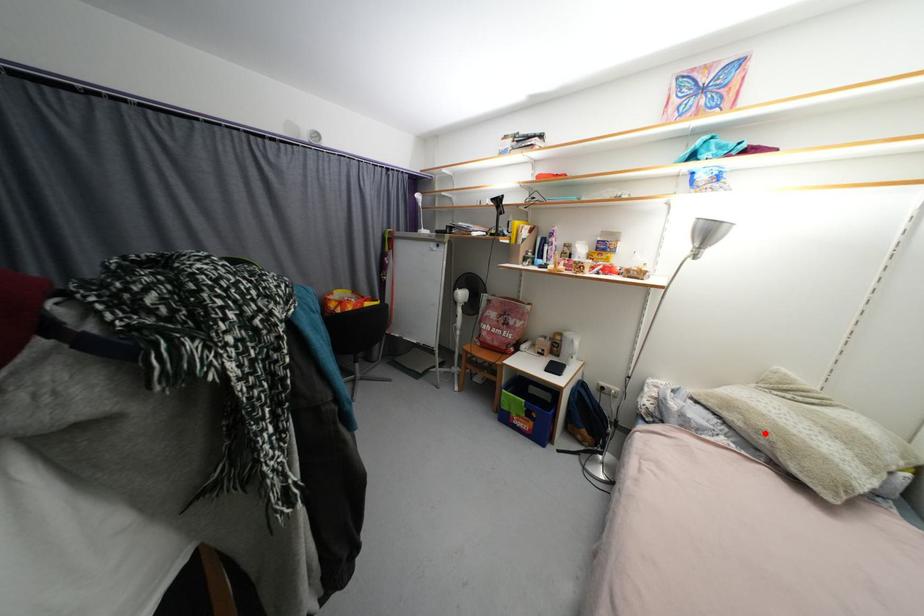
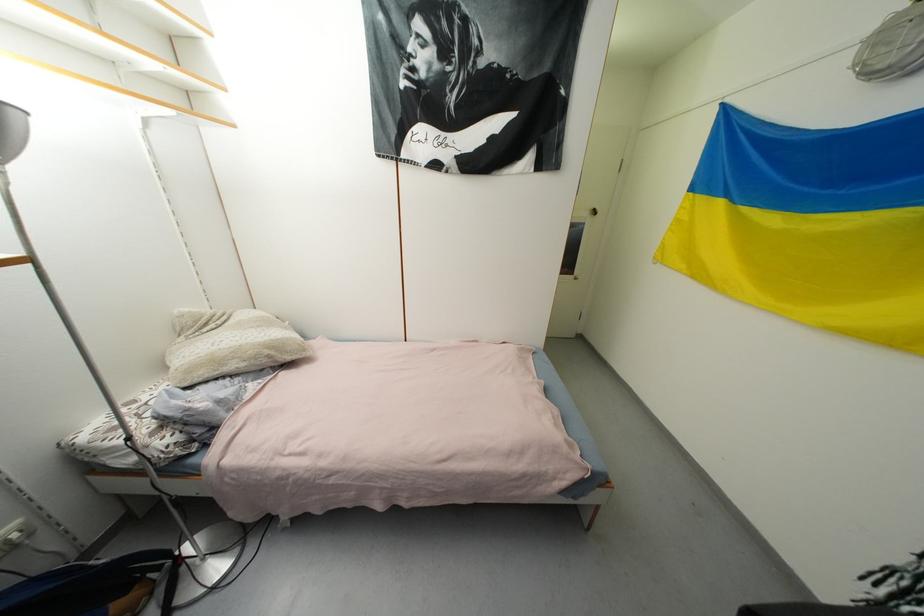
In the second image, find the point that corresponds to the highlighted location in the first image.

(261, 359)